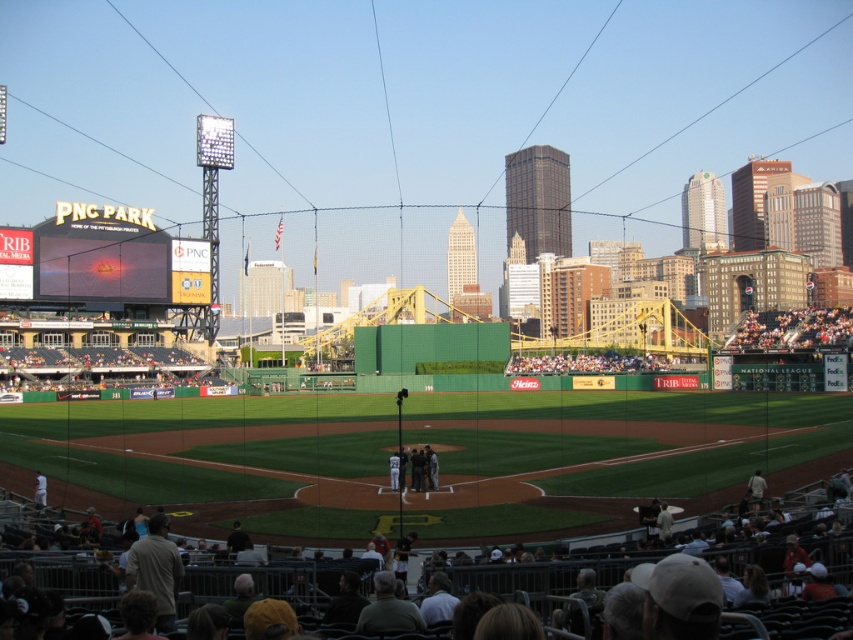
Looking at this image, you are a spectator at PNC Park and want to find a spot to watch the game. You see the dark brown leather seats at lower center and the dark brown wooden bench at upper right. Which seating area is located above the other?

The dark brown wooden bench at upper right is positioned above the dark brown leather seats at lower center.

You are a photographer at PNC Park and want to capture a photo of the white uniformed players at center without the matte black scoreboard at upper left blocking the view. Is this possible from your current position?

The white uniformed players at center are positioned behind the matte black scoreboard at upper left, so it is not possible to capture a clear photo of the white uniformed players at center without the matte black scoreboard at upper left blocking the view from your current position.

You are a photographer at PNC Park trying to capture a shot of the dark brown leather seats at lower center and the matte black scoreboard at upper left. Which object is positioned lower in the image?

The dark brown leather seats at lower center is positioned below the matte black scoreboard at upper left, so the dark brown leather seats at lower center is lower in the image.